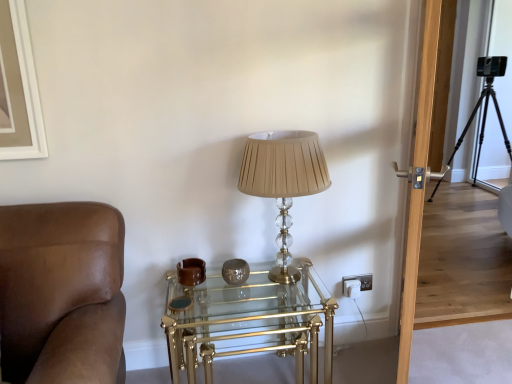
Identify the location of black metal tripod at right. This screenshot has height=384, width=512. (476, 112).

Measure the distance between point [172,321] and camera.

1.70 meters.

The height and width of the screenshot is (384, 512). Identify the location of clear glass/golden metal table at center. (247, 320).

What is the approximate width of translucent beige lampshade at center?

translucent beige lampshade at center is 13.40 inches in width.

In order to click on black metal tripod at right in this screenshot , I will do `click(476, 112)`.

Locate an element on the screen. This screenshot has width=512, height=384. tripod located behind the clear glass/golden metal table at center is located at coordinates (476, 112).

Is black metal tripod at right not close to clear glass/golden metal table at center?

Yes.

Could you tell me if black metal tripod at right is facing clear glass/golden metal table at center?

No, black metal tripod at right is not aimed at clear glass/golden metal table at center.

Is clear glass/golden metal table at center a part of black metal tripod at right?

No.

From a real-world perspective, is black metal tripod at right located higher than translucent beige lampshade at center?

No, from a real-world perspective, black metal tripod at right is not on top of translucent beige lampshade at center.

From their relative heights in the image, would you say black metal tripod at right is taller or shorter than translucent beige lampshade at center?

Clearly, black metal tripod at right is taller compared to translucent beige lampshade at center.

Is black metal tripod at right next to translucent beige lampshade at center?

They are not placed beside each other.

From the image's perspective, is black metal tripod at right located beneath transparent wooden door at right?

Actually, black metal tripod at right appears above transparent wooden door at right in the image.

Is the depth of black metal tripod at right less than that of transparent wooden door at right?

No, the depth of black metal tripod at right is greater than that of transparent wooden door at right.

Is transparent wooden door at right inside black metal tripod at right?

No, transparent wooden door at right is not a part of black metal tripod at right.

Based on the photo, who is bigger, black metal tripod at right or transparent wooden door at right?

Bigger between the two is black metal tripod at right.

Considering the relative sizes of translucent beige lampshade at center and black metal tripod at right in the image provided, is translucent beige lampshade at center wider than black metal tripod at right?

No.

Does translucent beige lampshade at center come in front of black metal tripod at right?

Yes, the depth of translucent beige lampshade at center is less than that of black metal tripod at right.

Consider the image. From a real-world perspective, is translucent beige lampshade at center under black metal tripod at right?

No, from a real-world perspective, translucent beige lampshade at center is not beneath black metal tripod at right.

Where is `lamp on the left of black metal tripod at right`? lamp on the left of black metal tripod at right is located at coordinates (283, 182).

Which object is positioned more to the left, clear glass/golden metal table at center or translucent beige lampshade at center?

clear glass/golden metal table at center is more to the left.

Considering the sizes of objects clear glass/golden metal table at center and translucent beige lampshade at center in the image provided, who is wider, clear glass/golden metal table at center or translucent beige lampshade at center?

With larger width is clear glass/golden metal table at center.

Which is behind, clear glass/golden metal table at center or translucent beige lampshade at center?

clear glass/golden metal table at center.

Which is more to the left, translucent beige lampshade at center or transparent wooden door at right?

translucent beige lampshade at center is more to the left.

Between translucent beige lampshade at center and transparent wooden door at right, which one has less height?

With less height is translucent beige lampshade at center.

Looking at this image, what's the angular difference between translucent beige lampshade at center and transparent wooden door at right's facing directions?

123 degrees.

Is point (302, 185) positioned before point (432, 66)?

No, (302, 185) is behind (432, 66).

Can you confirm if transparent wooden door at right is thinner than translucent beige lampshade at center?

Correct, the width of transparent wooden door at right is less than that of translucent beige lampshade at center.

Considering the points (429, 21) and (251, 194), which point is in front, point (429, 21) or point (251, 194)?

The point (429, 21) is closer to the camera.

Consider the image. Which of these two, transparent wooden door at right or translucent beige lampshade at center, is smaller?

With smaller size is translucent beige lampshade at center.

Find the location of a particular element. tripod above the clear glass/golden metal table at center (from a real-world perspective) is located at coordinates (476, 112).

Locate an element on the screen. This screenshot has height=384, width=512. lamp in front of the black metal tripod at right is located at coordinates (283, 182).

Consider the image. When comparing their distances from black metal tripod at right, does transparent wooden door at right or translucent beige lampshade at center seem further?

translucent beige lampshade at center is further to black metal tripod at right.

From the picture: When comparing their distances from translucent beige lampshade at center, does clear glass/golden metal table at center or black metal tripod at right seem further?

black metal tripod at right lies further to translucent beige lampshade at center than the other object.

From the picture: Looking at the image, which one is located closer to transparent wooden door at right, clear glass/golden metal table at center or translucent beige lampshade at center?

translucent beige lampshade at center is closer to transparent wooden door at right.

When comparing their distances from clear glass/golden metal table at center, does translucent beige lampshade at center or black metal tripod at right seem closer?

translucent beige lampshade at center.

From the image, which object appears to be farther from black metal tripod at right, translucent beige lampshade at center or clear glass/golden metal table at center?

translucent beige lampshade at center is further to black metal tripod at right.

Based on their spatial positions, is translucent beige lampshade at center or black metal tripod at right closer to transparent wooden door at right?

translucent beige lampshade at center is closer to transparent wooden door at right.

From the image, which object appears to be nearer to clear glass/golden metal table at center, translucent beige lampshade at center or transparent wooden door at right?

translucent beige lampshade at center is positioned closer to the anchor clear glass/golden metal table at center.

When comparing their distances from black metal tripod at right, does translucent beige lampshade at center or transparent wooden door at right seem further?

Among the two, translucent beige lampshade at center is located further to black metal tripod at right.

This screenshot has width=512, height=384. I want to click on lamp between clear glass/golden metal table at center and transparent wooden door at right in the horizontal direction, so click(283, 182).

I want to click on lamp between transparent wooden door at right and black metal tripod at right in the front-back direction, so click(283, 182).

Where is `table between translucent beige lampshade at center and black metal tripod at right from front to back`? Image resolution: width=512 pixels, height=384 pixels. table between translucent beige lampshade at center and black metal tripod at right from front to back is located at coordinates (247, 320).

The height and width of the screenshot is (384, 512). I want to click on table between transparent wooden door at right and black metal tripod at right in the front-back direction, so coord(247,320).